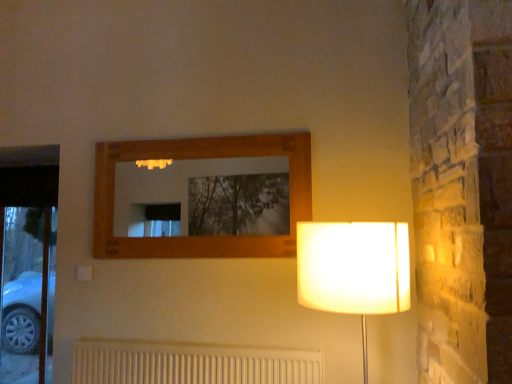
Question: Would you say white textured radiator at lower center is inside or outside white fabric lampshade at right?

Choices:
 (A) outside
 (B) inside

Answer: (A)

Question: Is white textured radiator at lower center in front of or behind white fabric lampshade at right in the image?

Choices:
 (A) front
 (B) behind

Answer: (B)

Question: From a real-world perspective, is white textured radiator at lower center physically located above or below white fabric lampshade at right?

Choices:
 (A) below
 (B) above

Answer: (A)

Question: From the image's perspective, is white fabric lampshade at right positioned above or below white textured radiator at lower center?

Choices:
 (A) above
 (B) below

Answer: (A)

Question: Does point coord(409,264) appear closer or farther from the camera than point coord(192,362)?

Choices:
 (A) farther
 (B) closer

Answer: (B)

Question: From a real-world perspective, is white fabric lampshade at right physically located above or below white textured radiator at lower center?

Choices:
 (A) below
 (B) above

Answer: (B)

Question: In the image, is white fabric lampshade at right positioned in front of or behind white textured radiator at lower center?

Choices:
 (A) front
 (B) behind

Answer: (A)